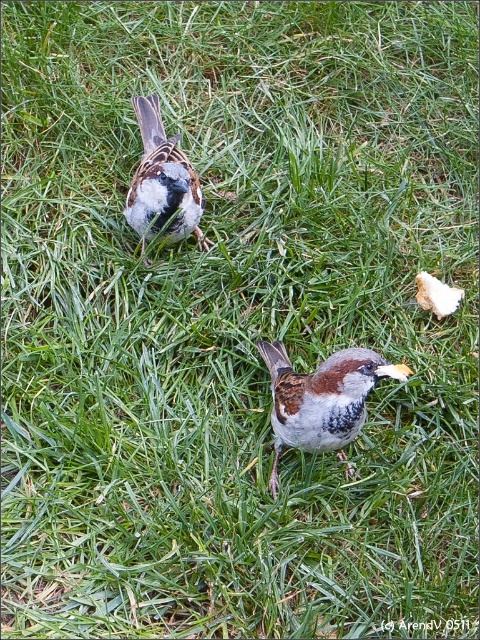
Question: Is brown speckled sparrow at center in front of brown speckled sparrow at upper center?

Choices:
 (A) no
 (B) yes

Answer: (B)

Question: Which of the following is the closest to the observer?

Choices:
 (A) brown speckled sparrow at upper center
 (B) brown speckled sparrow at center

Answer: (B)

Question: Does brown speckled sparrow at center have a lesser width compared to brown speckled sparrow at upper center?

Choices:
 (A) yes
 (B) no

Answer: (B)

Question: Can you confirm if brown speckled sparrow at center is positioned below brown speckled sparrow at upper center?

Choices:
 (A) no
 (B) yes

Answer: (B)

Question: Among these objects, which one is farthest from the camera?

Choices:
 (A) brown speckled sparrow at upper center
 (B) brown speckled sparrow at center

Answer: (A)